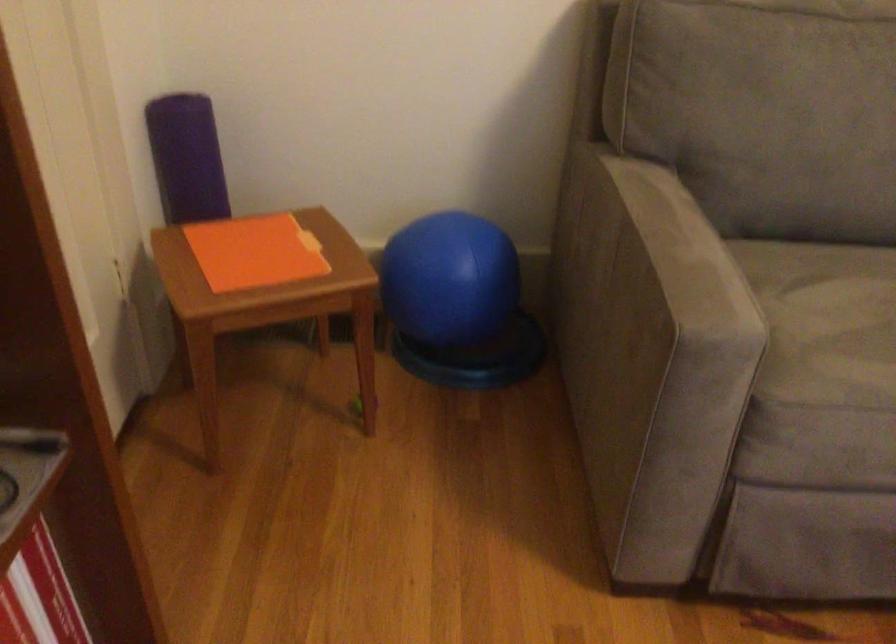
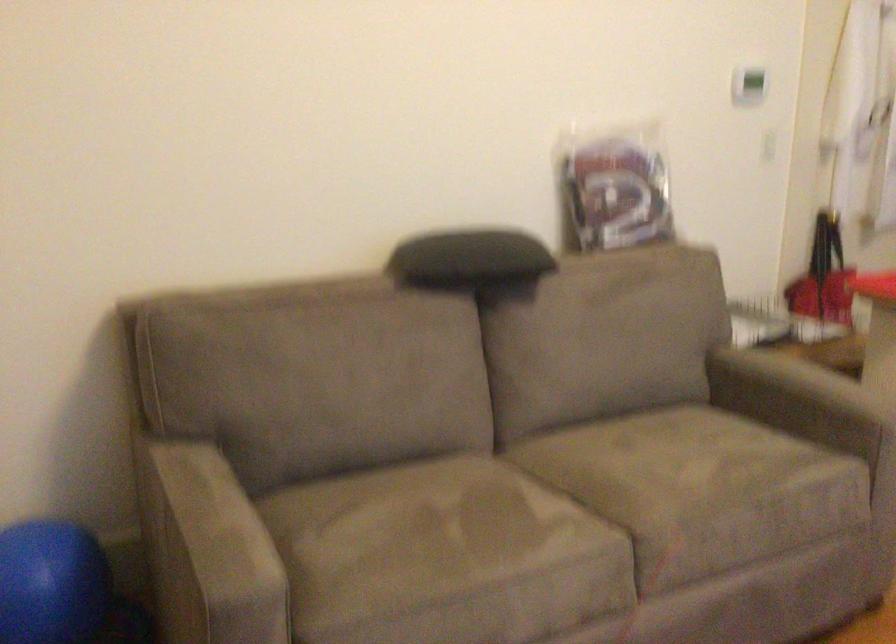
Locate, in the second image, the point that corresponds to point (682, 279) in the first image.

(209, 550)